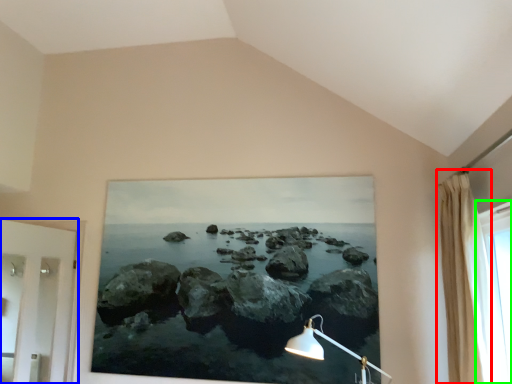
Question: Considering the real-world distances, which object is closest to curtain (highlighted by a red box)? door (highlighted by a blue box) or window (highlighted by a green box).

Choices:
 (A) door
 (B) window

Answer: (B)